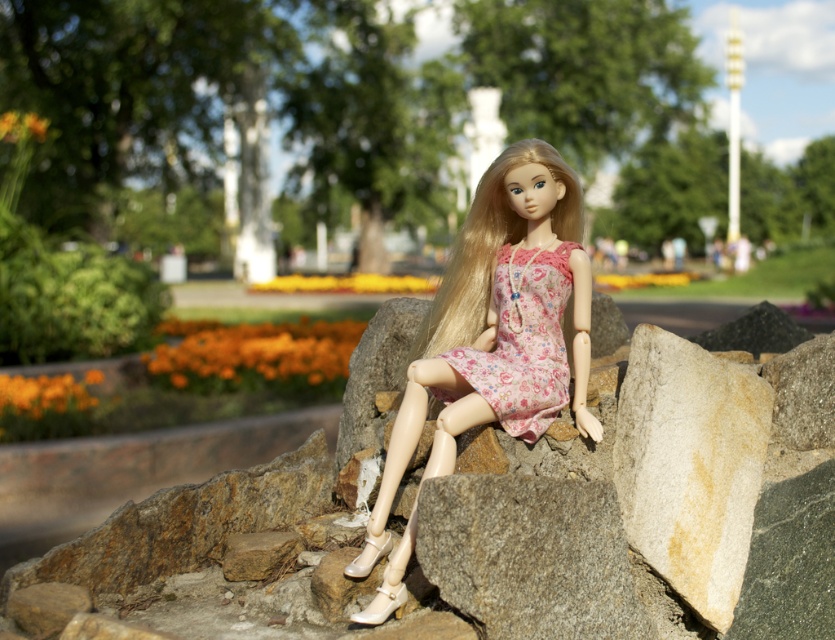
You are a photographer trying to capture the doll in the park. You notice a point at coordinates (524, 340) in your camera viewfinder. Based on the scene description, can you determine what this point is likely resting on?

The point at coordinates (524, 340) is on the floral fabric dress at center, so it is resting on the doll.